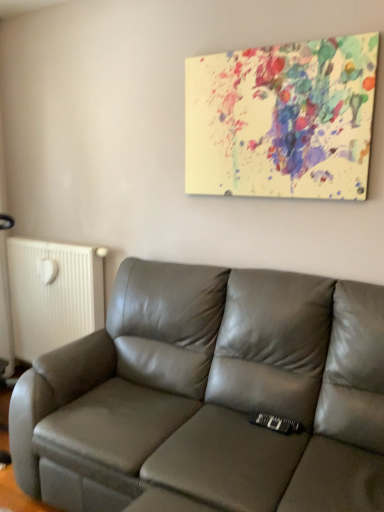
The height and width of the screenshot is (512, 384). What do you see at coordinates (282, 120) in the screenshot?
I see `paint splatter canvas at upper center` at bounding box center [282, 120].

Image resolution: width=384 pixels, height=512 pixels. I want to click on paint splatter canvas at upper center, so click(x=282, y=120).

Is white matte radiator at left wider or thinner than satin gray leather couch at center?

Clearly, white matte radiator at left has less width compared to satin gray leather couch at center.

Is satin gray leather couch at center inside white matte radiator at left?

Definitely not — satin gray leather couch at center is not inside white matte radiator at left.

Is the position of white matte radiator at left less distant than that of satin gray leather couch at center?

No, white matte radiator at left is further to the viewer.

Which of these two, white matte radiator at left or satin gray leather couch at center, is smaller?

white matte radiator at left is smaller.

Does paint splatter canvas at upper center lie behind satin gray leather couch at center?

Yes, paint splatter canvas at upper center is further from the camera.

Which of these two, paint splatter canvas at upper center or satin gray leather couch at center, is thinner?

paint splatter canvas at upper center is thinner.

Does paint splatter canvas at upper center contain satin gray leather couch at center?

No, satin gray leather couch at center is not inside paint splatter canvas at upper center.

From a real-world perspective, which is physically above, paint splatter canvas at upper center or satin gray leather couch at center?

From a 3D spatial view, paint splatter canvas at upper center is above.

Can you tell me how much white matte radiator at left and paint splatter canvas at upper center differ in facing direction?

There is a 0.215-degree angle between the facing directions of white matte radiator at left and paint splatter canvas at upper center.

Would you say paint splatter canvas at upper center is part of white matte radiator at left's contents?

That's incorrect, paint splatter canvas at upper center is not inside white matte radiator at left.

Which object is thinner, white matte radiator at left or paint splatter canvas at upper center?

Thinner between the two is paint splatter canvas at upper center.

From the image's perspective, would you say white matte radiator at left is positioned over paint splatter canvas at upper center?

No, from the image's perspective, white matte radiator at left is not on top of paint splatter canvas at upper center.

At what (x,y) coordinates should I click in order to perform the action: click on picture frame on the right of white matte radiator at left. Please return your answer as a coordinate pair (x, y). The image size is (384, 512). Looking at the image, I should click on (282, 120).

Which object is further away from the camera taking this photo, paint splatter canvas at upper center or white matte radiator at left?

Positioned behind is white matte radiator at left.

Is paint splatter canvas at upper center oriented away from white matte radiator at left?

No, white matte radiator at left is not at the back of paint splatter canvas at upper center.

Considering the sizes of objects satin gray leather couch at center and paint splatter canvas at upper center in the image provided, who is shorter, satin gray leather couch at center or paint splatter canvas at upper center?

paint splatter canvas at upper center is shorter.

Where is `picture frame on the right of satin gray leather couch at center`? The height and width of the screenshot is (512, 384). picture frame on the right of satin gray leather couch at center is located at coordinates (282, 120).

Would you say satin gray leather couch at center contains paint splatter canvas at upper center?

No, satin gray leather couch at center does not contain paint splatter canvas at upper center.

From a real-world perspective, which is physically above, satin gray leather couch at center or paint splatter canvas at upper center?

paint splatter canvas at upper center is physically above.

Consider the image. Is satin gray leather couch at center located outside white matte radiator at left?

Indeed, satin gray leather couch at center is completely outside white matte radiator at left.

Looking at their sizes, would you say satin gray leather couch at center is wider or thinner than white matte radiator at left?

satin gray leather couch at center is wider than white matte radiator at left.

Who is shorter, satin gray leather couch at center or white matte radiator at left?

white matte radiator at left is shorter.

You are a GUI agent. You are given a task and a screenshot of the screen. Output one action in this format:
    pyautogui.click(x=<x>, y=<y>)
    Task: Click on the radiator above the satin gray leather couch at center (from the image's perspective)
    
    Given the screenshot: What is the action you would take?
    pyautogui.click(x=53, y=294)

You are a GUI agent. You are given a task and a screenshot of the screen. Output one action in this format:
    pyautogui.click(x=<x>, y=<y>)
    Task: Click on the picture frame behind the satin gray leather couch at center
    
    Given the screenshot: What is the action you would take?
    pyautogui.click(x=282, y=120)

Estimate the real-world distances between objects in this image. Which object is closer to paint splatter canvas at upper center, satin gray leather couch at center or white matte radiator at left?

The object closer to paint splatter canvas at upper center is satin gray leather couch at center.

Looking at the image, which one is located closer to satin gray leather couch at center, white matte radiator at left or paint splatter canvas at upper center?

paint splatter canvas at upper center is positioned closer to the anchor satin gray leather couch at center.

In the scene shown: Looking at the image, which one is located closer to white matte radiator at left, satin gray leather couch at center or paint splatter canvas at upper center?

Based on the image, satin gray leather couch at center appears to be nearer to white matte radiator at left.

From the image, which object appears to be nearer to paint splatter canvas at upper center, white matte radiator at left or satin gray leather couch at center?

The object closer to paint splatter canvas at upper center is satin gray leather couch at center.

When comparing their distances from white matte radiator at left, does paint splatter canvas at upper center or satin gray leather couch at center seem closer?

satin gray leather couch at center is closer to white matte radiator at left.

From the image, which object appears to be nearer to satin gray leather couch at center, paint splatter canvas at upper center or white matte radiator at left?

paint splatter canvas at upper center lies closer to satin gray leather couch at center than the other object.

At what (x,y) coordinates should I click in order to perform the action: click on picture frame located between satin gray leather couch at center and white matte radiator at left in the depth direction. Please return your answer as a coordinate pair (x, y). Looking at the image, I should click on (282, 120).